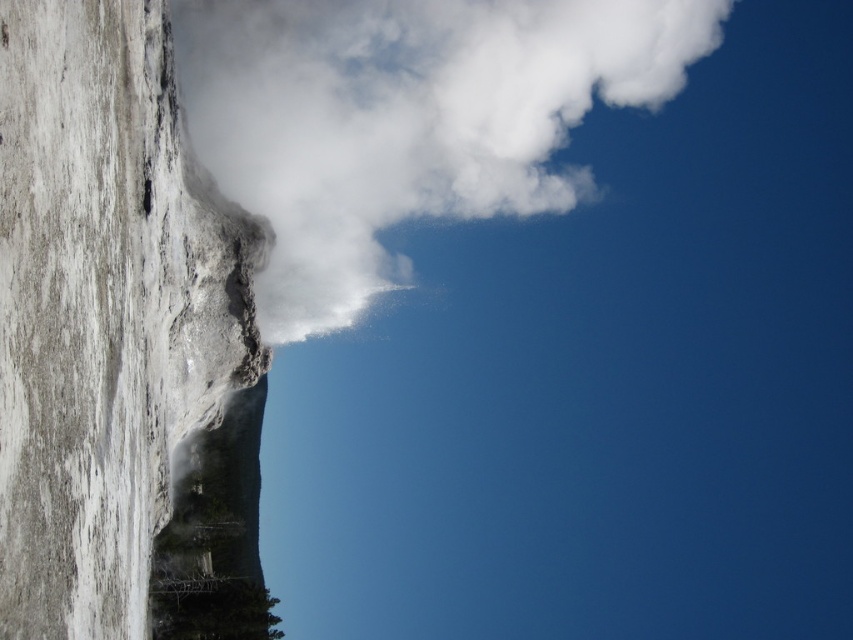
Is white stone rock face at left wider than white vapor cloud at upper center?

No.

Between white stone rock face at left and white vapor cloud at upper center, which one has more height?

white vapor cloud at upper center is taller.

Which is in front, point (114, 381) or point (387, 276)?

Point (114, 381)

In order to click on white stone rock face at left in this screenshot , I will do [120, 342].